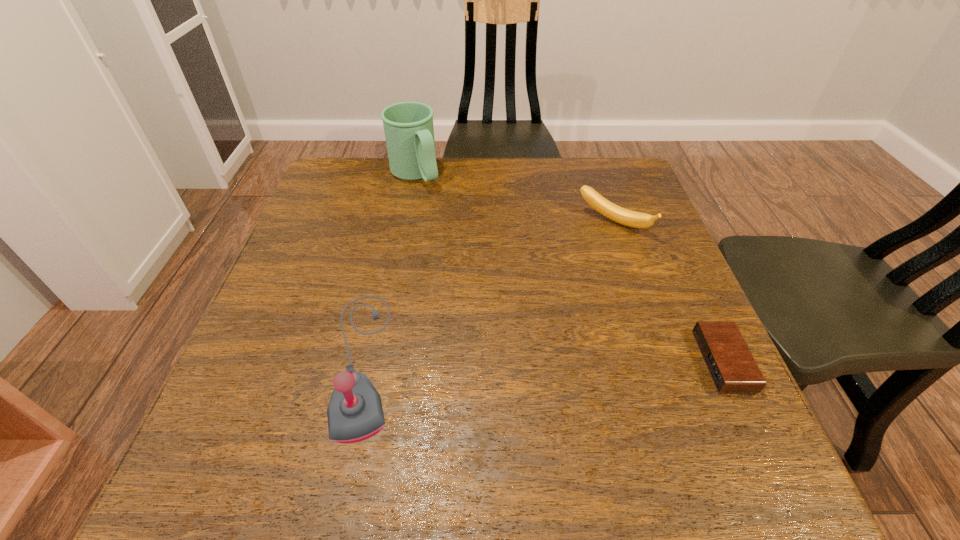
This screenshot has height=540, width=960. Find the location of `banana that is at the right edge`. banana that is at the right edge is located at coordinates (623, 216).

You are a GUI agent. You are given a task and a screenshot of the screen. Output one action in this format:
    pyautogui.click(x=<x>, y=<y>)
    Task: Click on the object present at the near right corner
    
    Given the screenshot: What is the action you would take?
    pyautogui.click(x=729, y=361)

In the image, there is a desktop. Where is `free space at the far edge`? This screenshot has height=540, width=960. free space at the far edge is located at coordinates (540, 205).

This screenshot has height=540, width=960. In the image, there is a desktop. Identify the location of blank space at the near edge. (444, 408).

Locate an element on the screen. The width and height of the screenshot is (960, 540). vacant region at the left edge of the desktop is located at coordinates (325, 316).

This screenshot has width=960, height=540. In order to click on vacant space at the right edge in this screenshot , I will do coord(660,237).

Locate an element on the screen. The width and height of the screenshot is (960, 540). vacant space at the far right corner of the desktop is located at coordinates (604, 192).

This screenshot has height=540, width=960. In the image, there is a desktop. What are the coordinates of `free space at the near right corner` in the screenshot? It's located at (728, 407).

Where is `free spot between the tallest object and the alarm clock`? Image resolution: width=960 pixels, height=540 pixels. free spot between the tallest object and the alarm clock is located at coordinates coord(569,268).

Find the location of a particular element. free space between the alarm clock and the second shortest object is located at coordinates (668, 292).